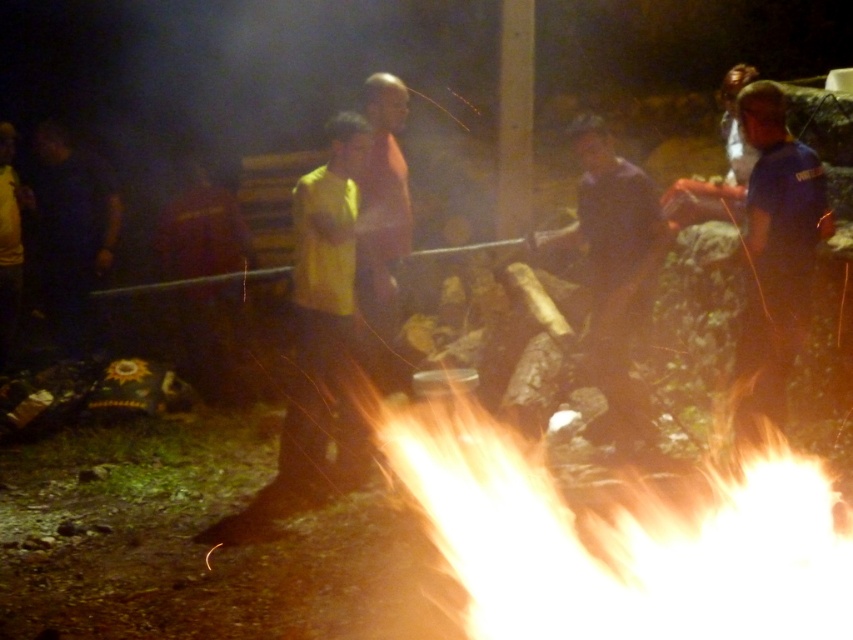
You are standing in the nighttime scene around the fire. You see the yellow matte shirt at center and the blue cotton shirt at right. Which person is closer to the fire?

The yellow matte shirt at center is positioned under blue cotton shirt at right, so the yellow matte shirt at center is closer to the fire than the blue cotton shirt at right.

You are a fire safety officer assessing the scene. The fire safety guidelines require a minimum distance of 5 feet between people and the firewood. Is the distance between the yellow matte shirt at center and the dark brown wood at center compliant with the guidelines?

The distance between the yellow matte shirt at center and the dark brown wood at center is 5.19 feet, which exceeds the required 5 feet minimum. Therefore, it complies with the fire safety guidelines.